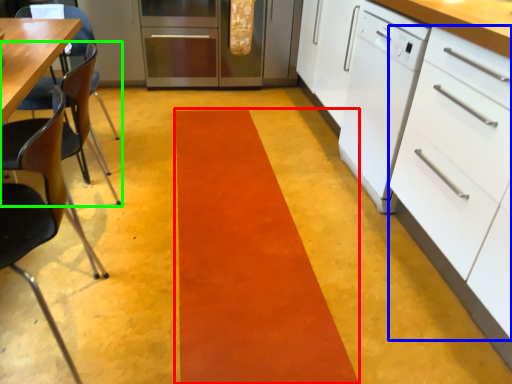
Question: Considering the real-world distances, which object is closest to strip (highlighted by a red box)? drawer (highlighted by a blue box) or chair (highlighted by a green box).

Choices:
 (A) drawer
 (B) chair

Answer: (A)